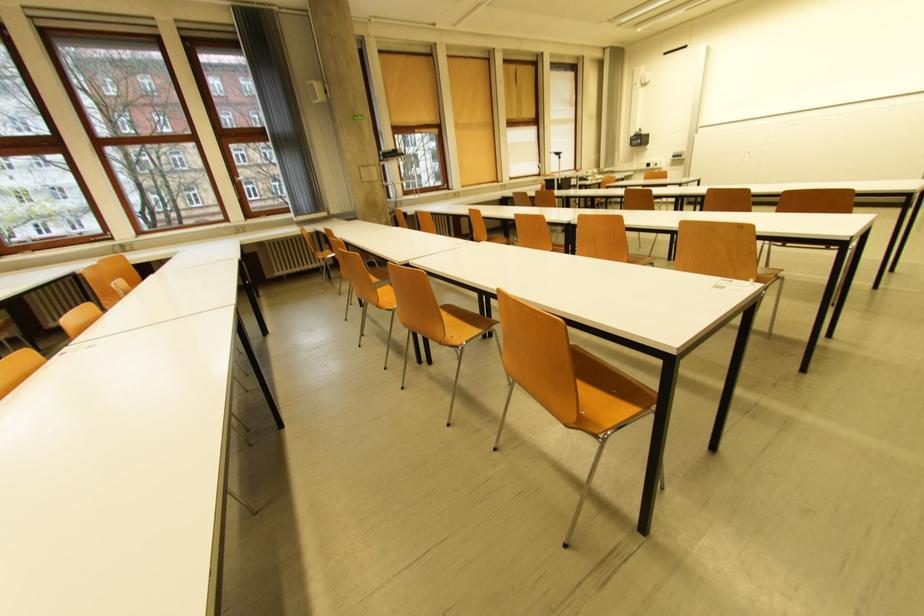
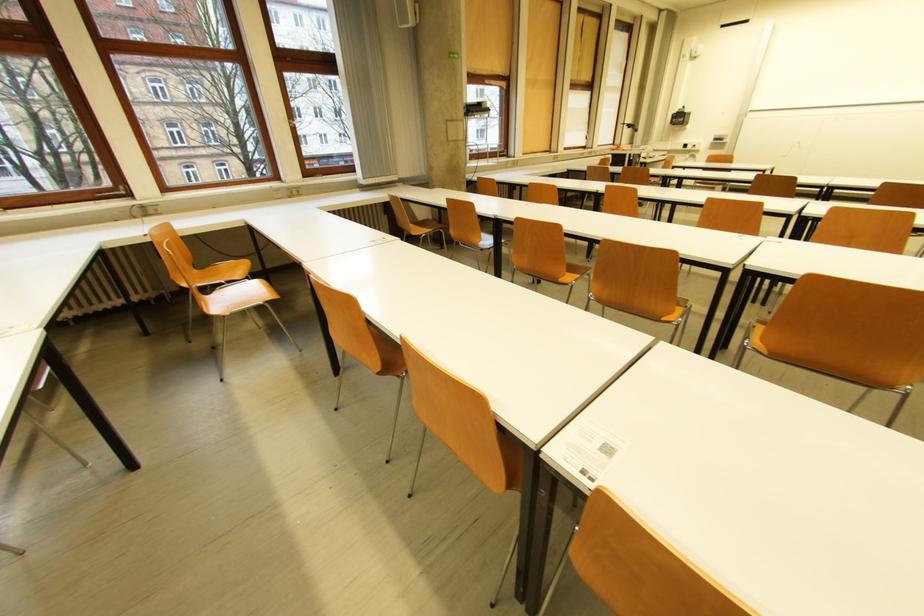
In a continuous first-person perspective shot, in which direction is the camera moving?

The movement direction of the cameraman is left, forward.